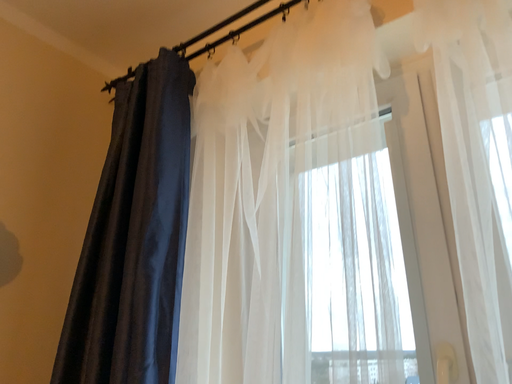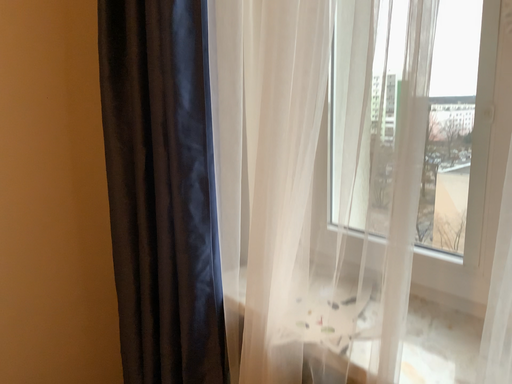
Question: Which way did the camera rotate in the video?

Choices:
 (A) rotated right
 (B) rotated left

Answer: (B)